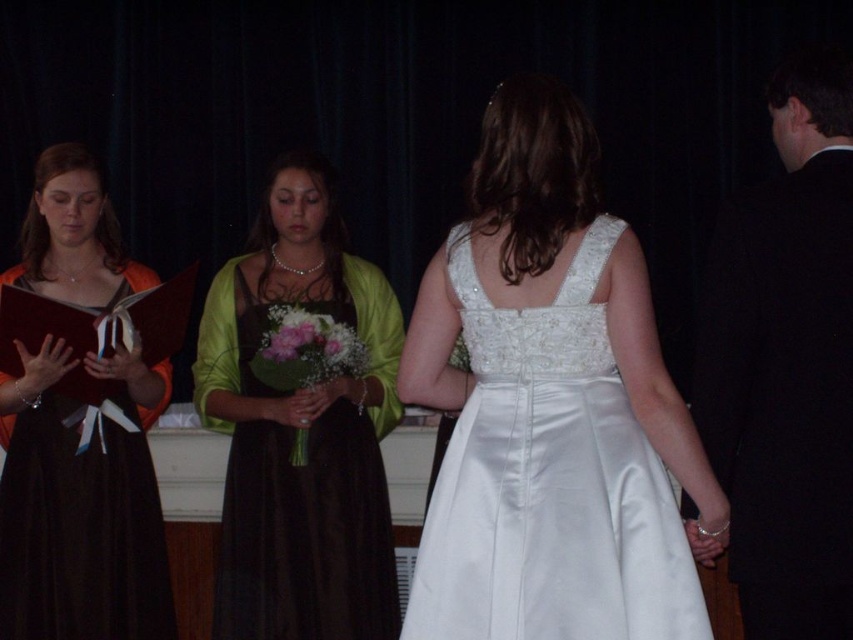
Question: Which of the following is the farthest from the observer?

Choices:
 (A) (292, 212)
 (B) (128, 376)
 (C) (514, 515)
 (D) (701, 328)

Answer: (A)

Question: Among these objects, which one is nearest to the camera?

Choices:
 (A) black satin suit at right
 (B) satin white dress at center

Answer: (B)

Question: Among these points, which one is farthest from the camera?

Choices:
 (A) click(x=840, y=412)
 (B) click(x=32, y=289)
 (C) click(x=328, y=616)

Answer: (B)

Question: Is satin white dress at center closer to camera compared to matte brown dress at center?

Choices:
 (A) yes
 (B) no

Answer: (A)

Question: In this image, where is black satin suit at right located relative to matte orange dress at left?

Choices:
 (A) below
 (B) above

Answer: (B)

Question: Is the position of satin white dress at center less distant than that of matte orange dress at left?

Choices:
 (A) no
 (B) yes

Answer: (B)